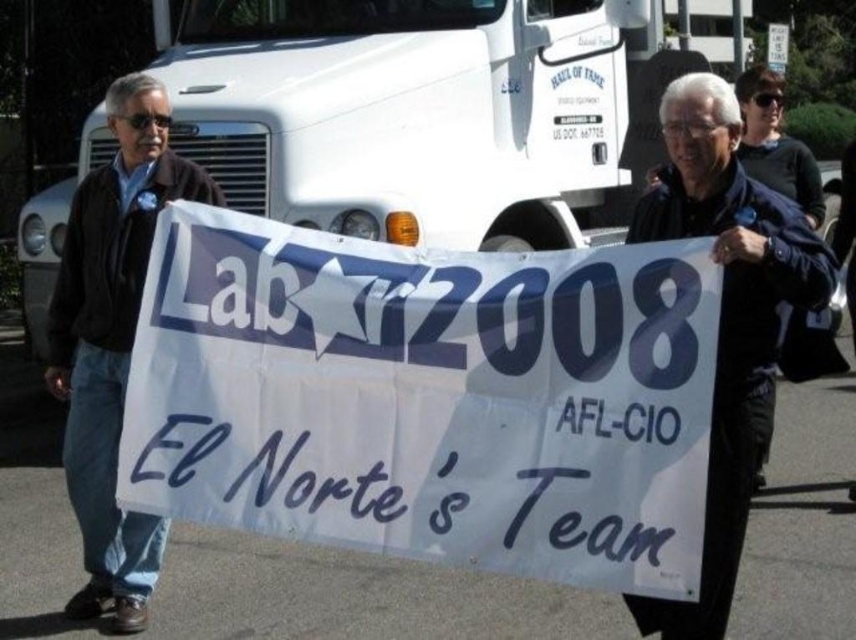
Question: Is white paper banner at center in front of dark brown leather jacket at left?

Choices:
 (A) no
 (B) yes

Answer: (B)

Question: Among these points, which one is nearest to the camera?

Choices:
 (A) (82, 280)
 (B) (510, 531)

Answer: (B)

Question: Is white paper banner at center positioned in front of dark brown leather jacket at left?

Choices:
 (A) no
 (B) yes

Answer: (B)

Question: Which object appears farthest from the camera in this image?

Choices:
 (A) dark brown leather jacket at left
 (B) white paper banner at center

Answer: (A)

Question: Which of the following is the closest to the observer?

Choices:
 (A) (257, 502)
 (B) (773, 362)

Answer: (A)

Question: In this image, where is black leather jacket at center located relative to dark brown leather jacket at left?

Choices:
 (A) above
 (B) below

Answer: (A)